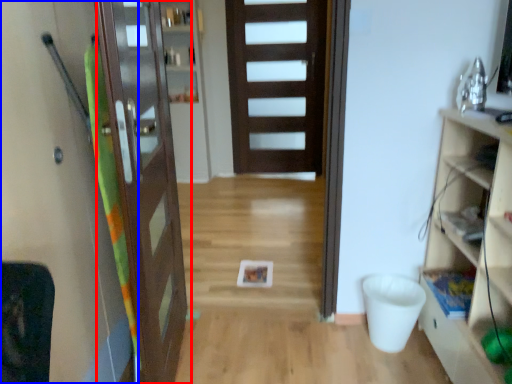
Question: Which object is further to the camera taking this photo, door (highlighted by a red box) or screen door (highlighted by a blue box)?

Choices:
 (A) door
 (B) screen door

Answer: (A)